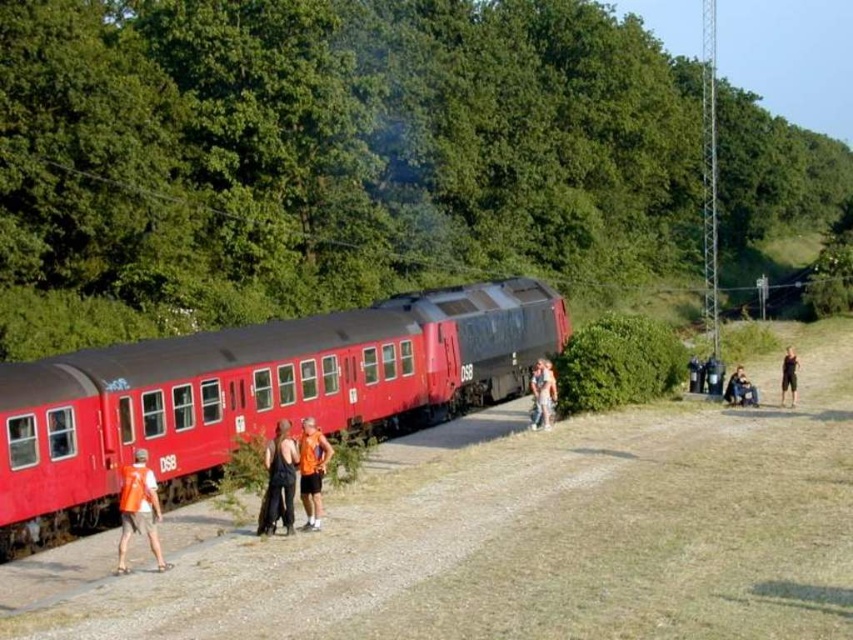
Between matte black tank top at center and orange sleeveless shirt at center, which one appears on the right side from the viewer's perspective?

orange sleeveless shirt at center is more to the right.

Is matte black tank top at center above orange sleeveless shirt at center?

Actually, matte black tank top at center is below orange sleeveless shirt at center.

Is point (277, 461) more distant than point (749, 404)?

That is False.

Locate an element on the screen. matte black tank top at center is located at coordinates (279, 480).

Is matte black tank top at center below orange fabric shorts at center?

Indeed, matte black tank top at center is positioned under orange fabric shorts at center.

Who is higher up, matte black tank top at center or orange fabric shorts at center?

orange fabric shorts at center is above.

Where is `matte black tank top at center`? matte black tank top at center is located at coordinates (279, 480).

What are the coordinates of `matte black tank top at center` in the screenshot? It's located at (279, 480).

Can you confirm if matte red train at center is positioned to the right of black fabric shorts at right?

No, matte red train at center is not to the right of black fabric shorts at right.

What do you see at coordinates (251, 394) in the screenshot?
I see `matte red train at center` at bounding box center [251, 394].

This screenshot has height=640, width=853. Identify the location of matte red train at center. (251, 394).